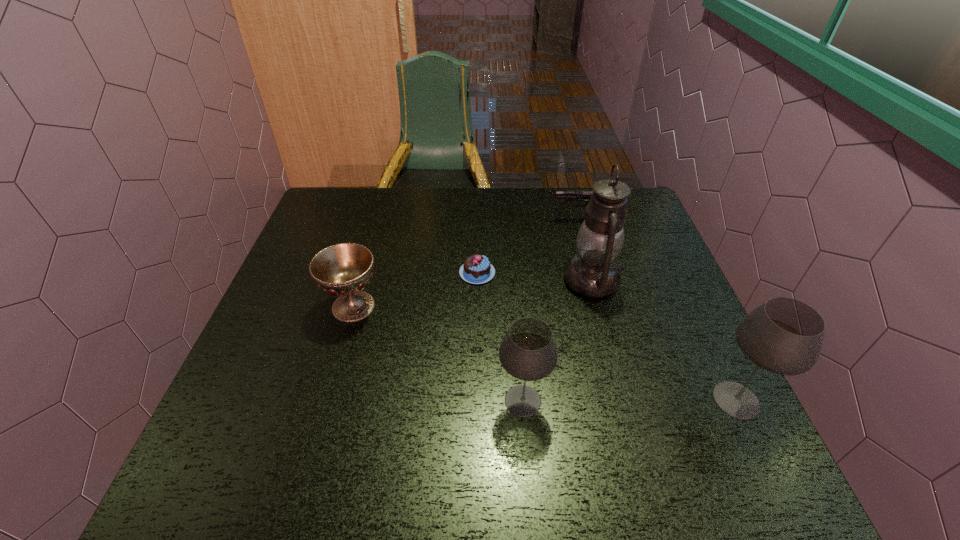
Identify the location of wineglass that is at the right edge. This screenshot has height=540, width=960. (784, 336).

I want to click on pistol present at the right edge, so click(x=560, y=195).

Locate an element on the screen. The image size is (960, 540). oil lamp at the right edge is located at coordinates (593, 272).

You are a GUI agent. You are given a task and a screenshot of the screen. Output one action in this format:
    pyautogui.click(x=<x>, y=<y>)
    Task: Click on the object that is at the far right corner
    
    Given the screenshot: What is the action you would take?
    pyautogui.click(x=560, y=195)

Find the location of a particular element. The height and width of the screenshot is (540, 960). object that is at the near right corner is located at coordinates (784, 336).

Locate an element on the screen. The image size is (960, 540). vacant space at the far edge is located at coordinates (381, 221).

The height and width of the screenshot is (540, 960). In the image, there is a desktop. Identify the location of vacant space at the near edge. click(405, 415).

Locate an element on the screen. This screenshot has width=960, height=540. vacant space at the right edge of the desktop is located at coordinates (635, 341).

Image resolution: width=960 pixels, height=540 pixels. Find the location of `vacant region at the far left corner`. vacant region at the far left corner is located at coordinates (338, 197).

At what (x,y) coordinates should I click in order to perform the action: click on free spot at the far right corner of the desktop. Please return your answer as a coordinate pair (x, y). The image size is (960, 540). Looking at the image, I should click on (644, 218).